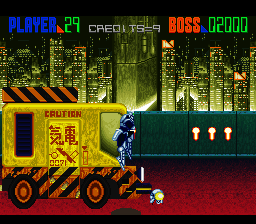
The image size is (256, 224). I want to click on wall, so click(165, 143).